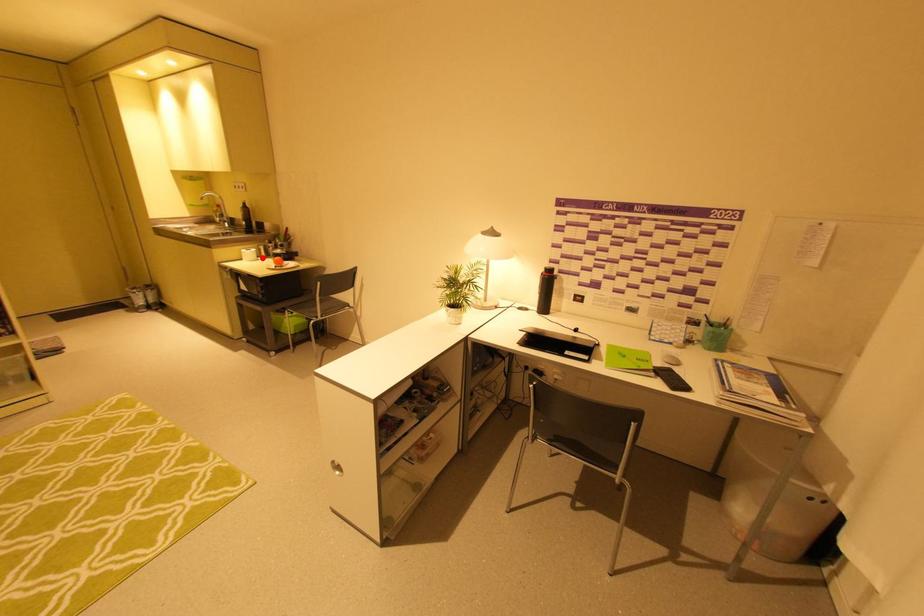
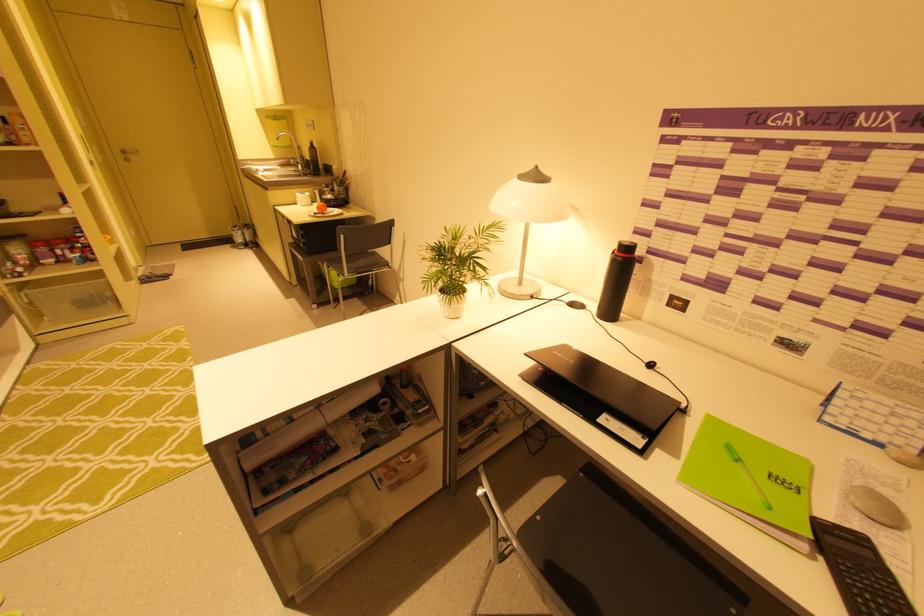
Question: I am providing you with two images of the same scene from different viewpoints. A red point is marked on the first image. At the location where the point appears in image 1, is it still visible in image 2?

Choices:
 (A) Yes
 (B) No

Answer: (A)